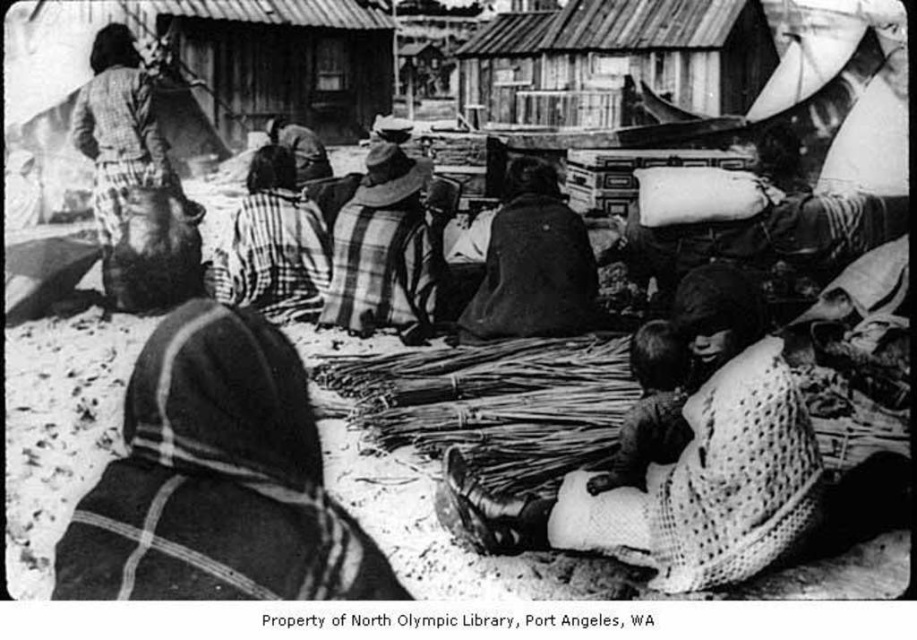
Question: Can you confirm if wooden hut at upper center is thinner than plaid fabric at center?

Choices:
 (A) yes
 (B) no

Answer: (A)

Question: Does plaid fabric at center appear under plaid fabric shirt at upper left?

Choices:
 (A) no
 (B) yes

Answer: (B)

Question: Estimate the real-world distances between objects in this image. Which object is closer to the plaid fabric shirt at upper left?

Choices:
 (A) smooth straw bundles at center
 (B) dark woolen shawl at center
 (C) wooden hut at upper center

Answer: (B)

Question: Considering the real-world distances, which object is closest to the wooden hut at upper center?

Choices:
 (A) plaid fabric shirt at upper left
 (B) plaid fabric at center
 (C) striped fabric shawl at center
 (D) dark woolen shawl at center

Answer: (B)

Question: Is wooden hut at upper center further to camera compared to dark woolen shawl at center?

Choices:
 (A) yes
 (B) no

Answer: (A)

Question: Which object is farther from the camera taking this photo?

Choices:
 (A) wooden hut at upper center
 (B) plaid fabric shirt at upper left
 (C) plaid fabric at center
 (D) striped fabric shawl at center

Answer: (A)